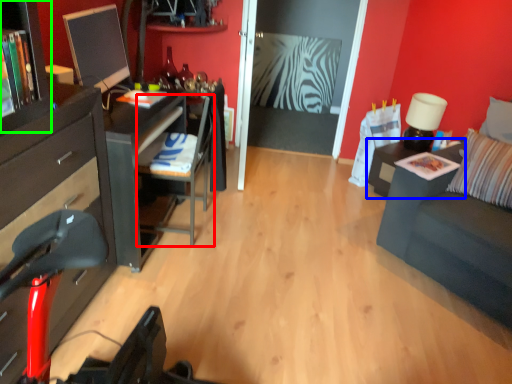
Question: Which object is positioned farthest from armchair (highlighted by a red box)? Select from nightstand (highlighted by a blue box) and tv cabinet (highlighted by a green box).

Choices:
 (A) nightstand
 (B) tv cabinet

Answer: (A)